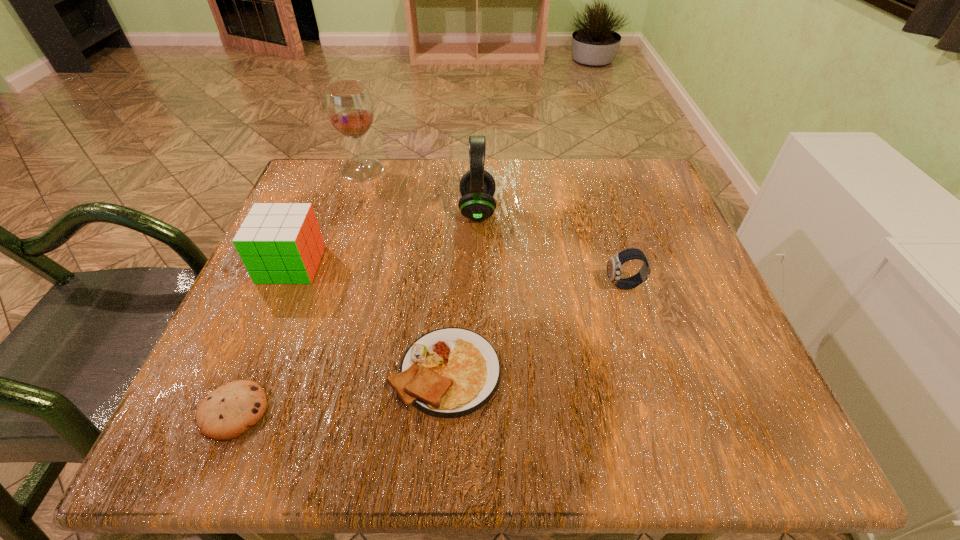
Identify the location of vacant area situated on the ear cups of the fifth shortest object. Image resolution: width=960 pixels, height=540 pixels. (597, 210).

Find the location of `free space located 0.100m on the back of the cube`. free space located 0.100m on the back of the cube is located at coordinates (312, 215).

This screenshot has height=540, width=960. In order to click on free spot located 0.340m on the face of the rightmost object in this screenshot , I will do `click(419, 285)`.

The image size is (960, 540). What are the coordinates of `vacant space situated on the face of the rightmost object` in the screenshot? It's located at (550, 285).

You are a GUI agent. You are given a task and a screenshot of the screen. Output one action in this format:
    pyautogui.click(x=<x>, y=<y>)
    Task: Click on the vacant space located on the face of the rightmost object
    
    Given the screenshot: What is the action you would take?
    pyautogui.click(x=408, y=285)

Identify the location of vacant space located 0.220m on the left of the omelet. (248, 371).

At what (x,y) coordinates should I click in order to perform the action: click on vacant space located on the right of the cookie. Please return your answer as a coordinate pair (x, y). Image resolution: width=960 pixels, height=540 pixels. Looking at the image, I should click on [x=393, y=411].

Where is `wineglass at the far edge`? This screenshot has height=540, width=960. wineglass at the far edge is located at coordinates (349, 107).

I want to click on headset present at the far edge, so click(x=477, y=187).

At what (x,y) coordinates should I click in order to perform the action: click on omelet present at the near edge. Please return your answer as a coordinate pair (x, y). The width and height of the screenshot is (960, 540). Looking at the image, I should click on 451,372.